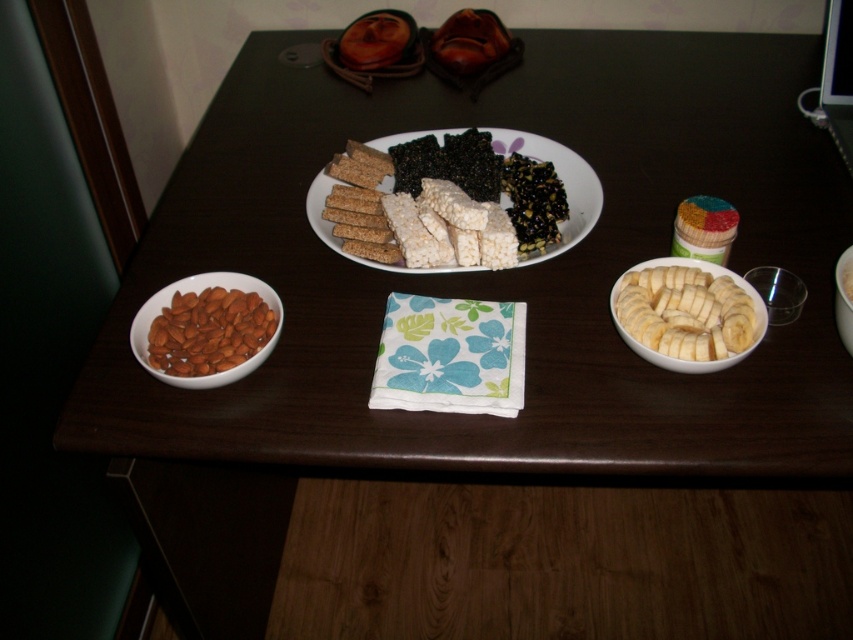
Question: Does white rice cake at center have a larger size compared to white ceramic bowl at center?

Choices:
 (A) no
 (B) yes

Answer: (B)

Question: Which point is closer to the camera taking this photo?

Choices:
 (A) (317, 196)
 (B) (227, 349)
 (C) (666, 268)
 (D) (851, 337)

Answer: (D)

Question: Is white smooth sliced bananas at right positioned behind white rice cake at center?

Choices:
 (A) yes
 (B) no

Answer: (B)

Question: Which object is closer to the camera taking this photo?

Choices:
 (A) white rice cake at center
 (B) white smooth sliced bananas at right

Answer: (B)

Question: Estimate the real-world distances between objects in this image. Which object is farther from the white smooth sliced bananas at right?

Choices:
 (A) smooth almond at left
 (B) white ceramic bowl at center
 (C) white rice cake at center

Answer: (A)

Question: Is smooth almond at left above white ceramic bowl at center?

Choices:
 (A) no
 (B) yes

Answer: (A)